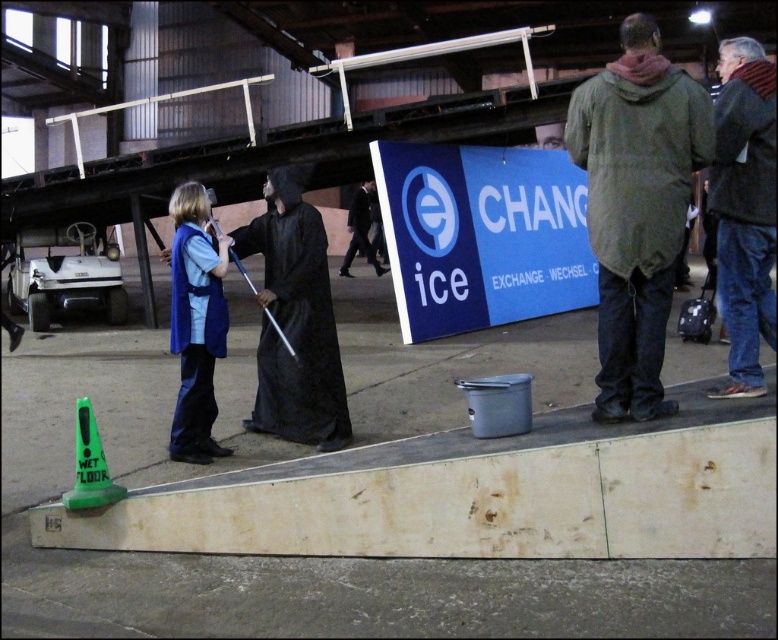
Question: Which of these objects is positioned farthest from the black matte robe at center?

Choices:
 (A) dark blue jeans at right
 (B) dark suit at center

Answer: (B)

Question: Is green matte raincoat at right positioned at the back of dark suit at center?

Choices:
 (A) yes
 (B) no

Answer: (B)

Question: Which point is closer to the camera?

Choices:
 (A) matte blue robe at left
 (B) green matte raincoat at right
 (C) dark blue jeans at right
 (D) black matte robe at center

Answer: (B)

Question: Is dark blue jeans at right thinner than dark suit at center?

Choices:
 (A) no
 (B) yes

Answer: (B)

Question: Does matte blue robe at left have a lesser width compared to dark suit at center?

Choices:
 (A) yes
 (B) no

Answer: (A)

Question: Which point is farther to the camera?

Choices:
 (A) green plastic cone at lower left
 (B) dark blue jeans at right

Answer: (A)